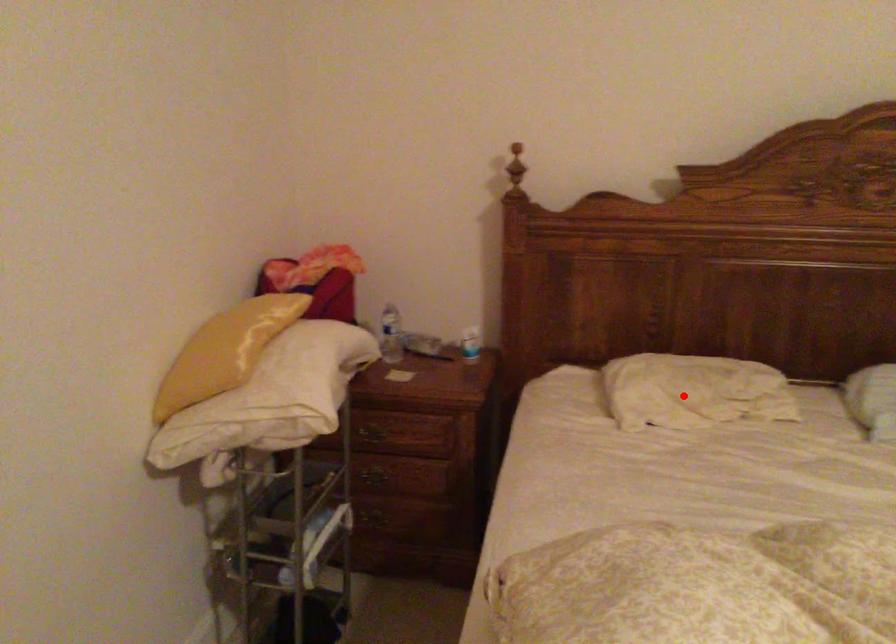
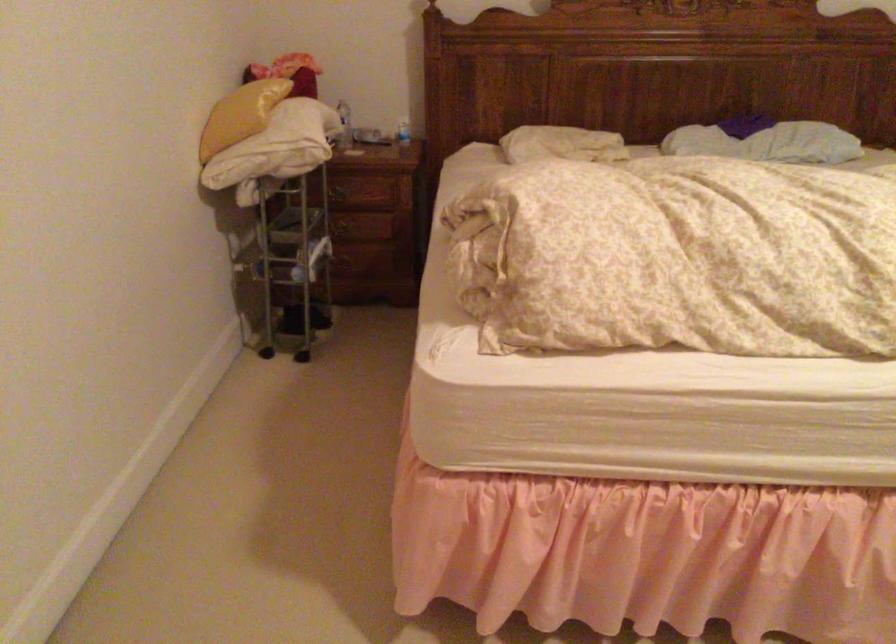
The point at the highlighted location is marked in the first image. Where is the corresponding point in the second image?

(561, 144)